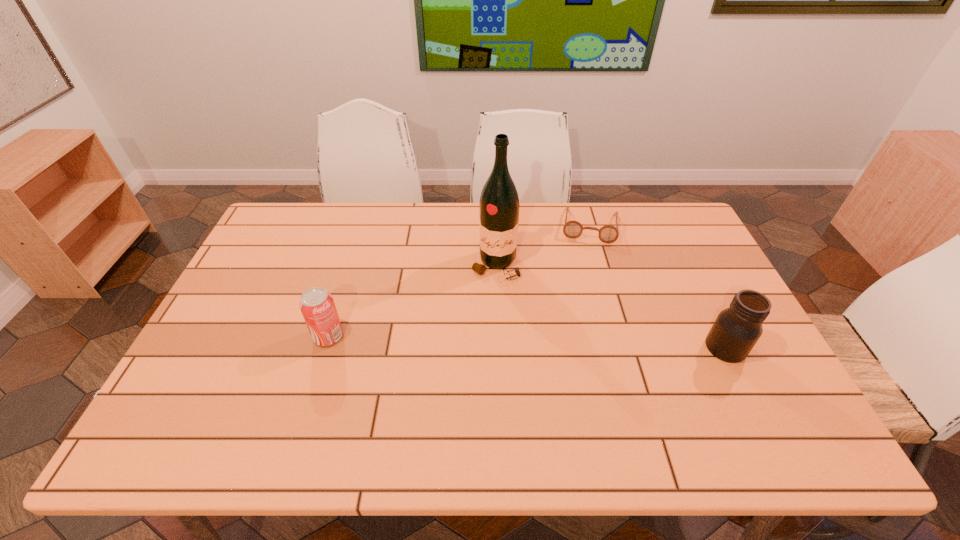
I want to click on vacant position located 0.280m on the back of the rightmost object, so click(684, 264).

The width and height of the screenshot is (960, 540). Identify the location of vacant space located 0.230m on the surface of the third nearest object. (476, 344).

The width and height of the screenshot is (960, 540). I want to click on vacant space positioned 0.290m on the surface of the third nearest object, so click(x=471, y=362).

You are a GUI agent. You are given a task and a screenshot of the screen. Output one action in this format:
    pyautogui.click(x=<x>, y=<y>)
    Task: Click on the vacant space located 0.150m on the surface of the third nearest object
    
    Given the screenshot: What is the action you would take?
    pyautogui.click(x=482, y=321)

Find the location of `free space located on the front-facing side of the third object from left to right`. free space located on the front-facing side of the third object from left to right is located at coordinates (586, 284).

The width and height of the screenshot is (960, 540). Identify the location of vacant region located 0.380m on the front-facing side of the third object from left to right. 582,332.

This screenshot has height=540, width=960. What are the coordinates of `vacant space located 0.260m on the front-facing side of the third object from left to right` in the screenshot? It's located at (585, 301).

Find the location of `object at the far edge`. object at the far edge is located at coordinates pyautogui.click(x=572, y=229).

Identify the location of object positioned at the right edge. (736, 330).

Identify the location of vacant position at the far edge of the desktop. The width and height of the screenshot is (960, 540). coord(389,204).